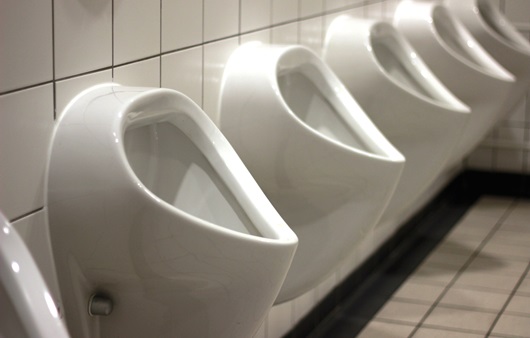
Locate an element on the screen. This screenshot has height=338, width=530. urinals is located at coordinates tap(32, 288), tap(150, 213), tap(279, 147), tap(416, 125), tap(469, 74), tap(506, 52).